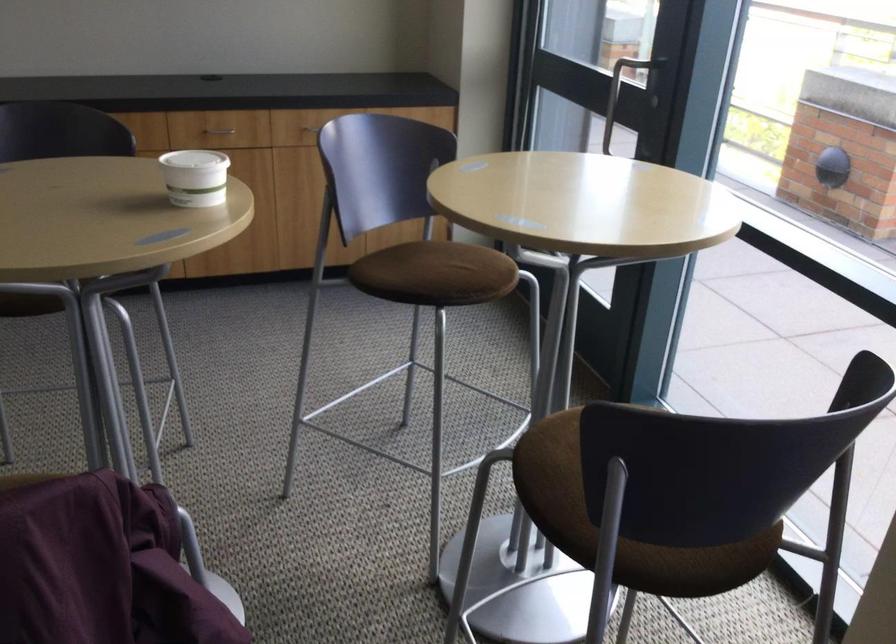
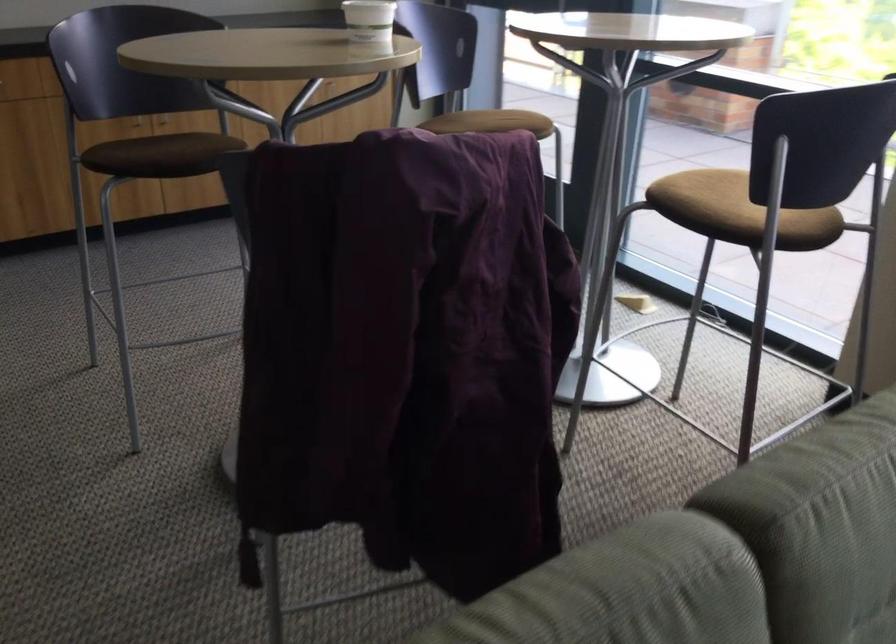
Locate, in the second image, the point that corresponds to point 186,178 in the first image.

(368, 20)